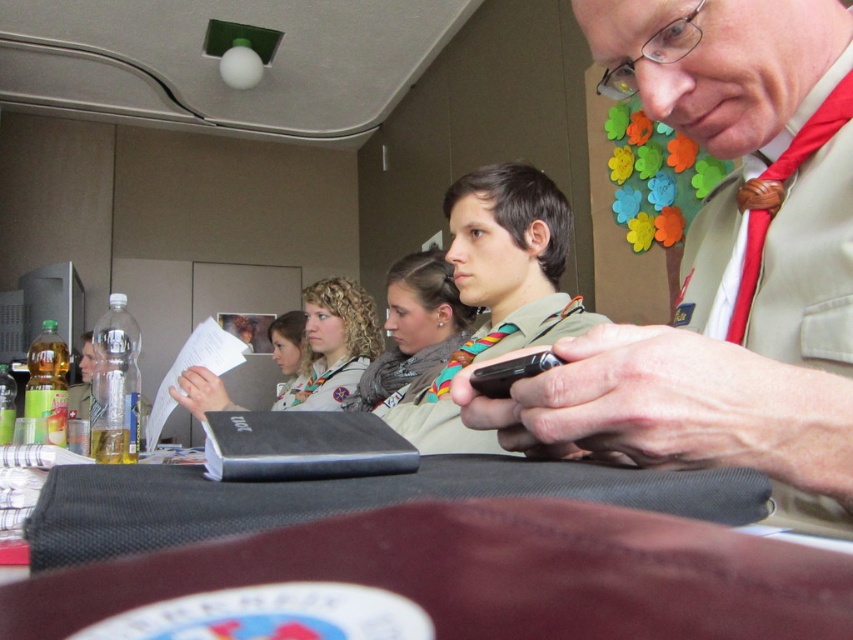
You are an observer looking at the scene. There is a khaki uniform at upper right and a white fabric scarf at center. Which object is shorter in height?

The khaki uniform at upper right is shorter than the white fabric scarf at center.